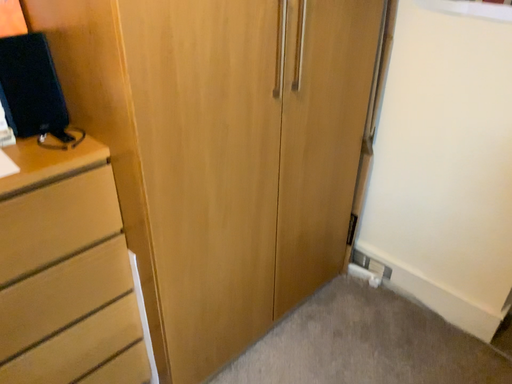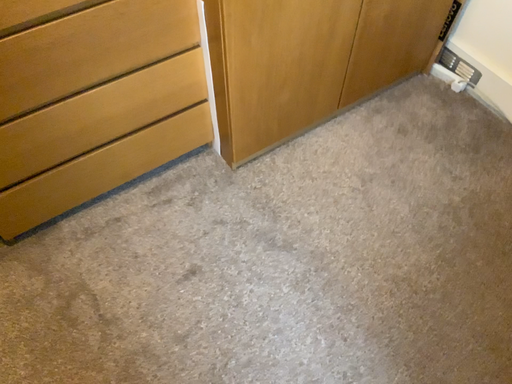
Question: How did the camera likely rotate when shooting the video?

Choices:
 (A) rotated upward
 (B) rotated downward

Answer: (B)